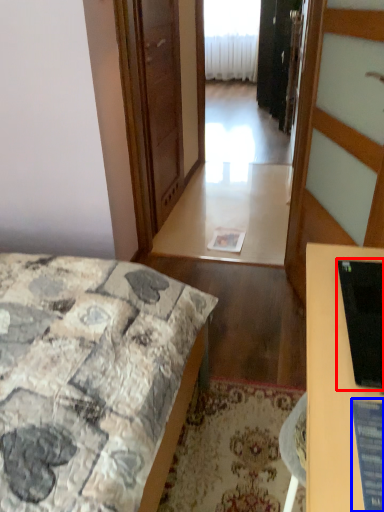
Question: Which object is closer to the camera taking this photo, computer monitor (highlighted by a red box) or computer screen (highlighted by a blue box)?

Choices:
 (A) computer monitor
 (B) computer screen

Answer: (B)